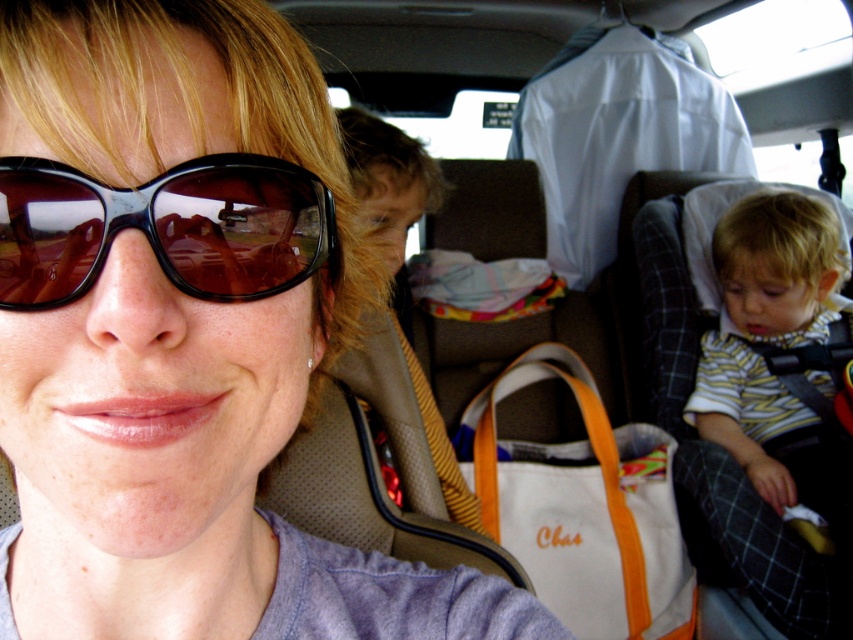
Question: Does black glossy sunglasses at center appear on the left side of white fabric bag at center?

Choices:
 (A) yes
 (B) no

Answer: (A)

Question: Which object is positioned closest to the black glossy sunglasses at center?

Choices:
 (A) striped cotton shirt at right
 (B) white fabric bag at center

Answer: (A)

Question: Is black glossy sunglasses at center bigger than striped cotton shirt at right?

Choices:
 (A) yes
 (B) no

Answer: (B)

Question: Which of the following is the closest to the observer?

Choices:
 (A) white fabric bag at center
 (B) striped cotton shirt at right

Answer: (B)

Question: Estimate the real-world distances between objects in this image. Which object is farther from the striped cotton shirt at right?

Choices:
 (A) black glossy sunglasses at center
 (B) white fabric bag at center

Answer: (A)

Question: Does striped cotton shirt at right appear on the left side of white fabric bag at center?

Choices:
 (A) no
 (B) yes

Answer: (A)